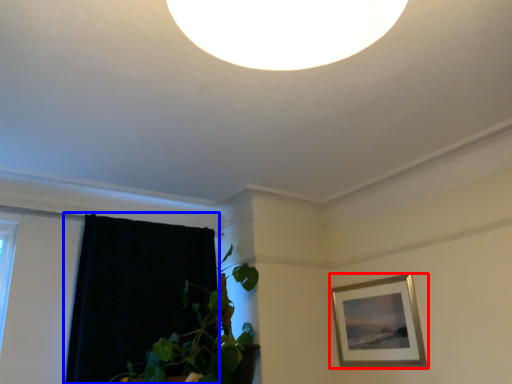
Question: Which point is further to the camera, picture frame (highlighted by a red box) or curtain (highlighted by a blue box)?

Choices:
 (A) picture frame
 (B) curtain

Answer: (A)